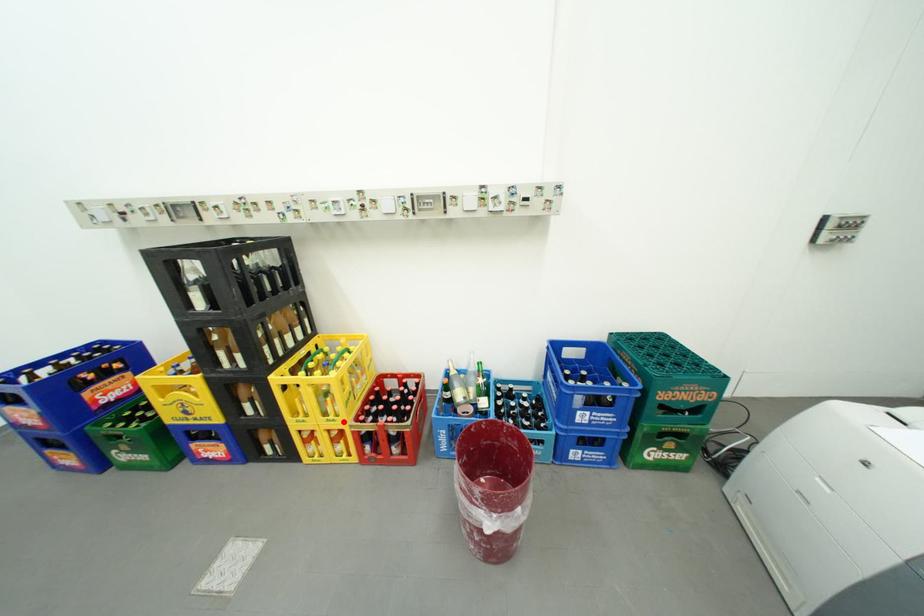
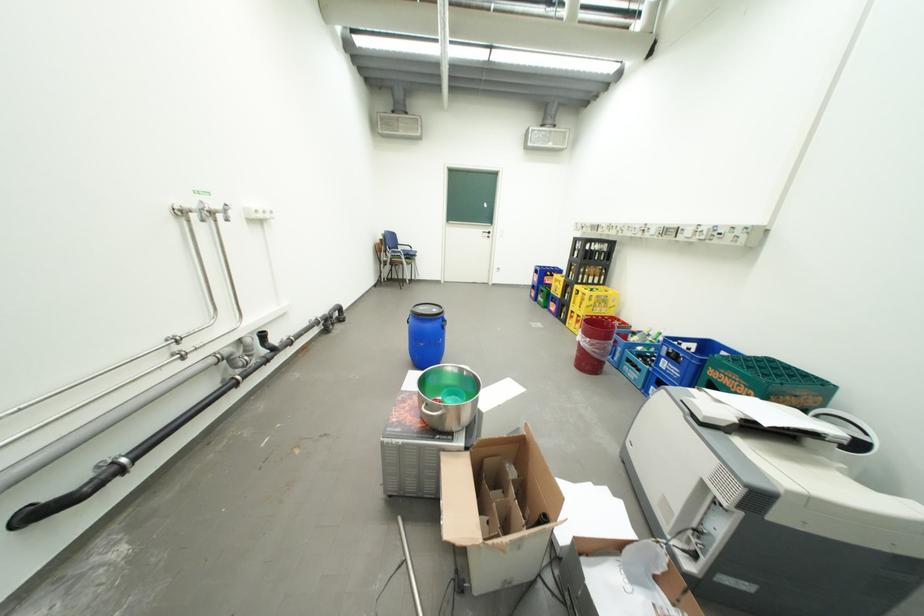
Question: I am providing you with two images of the same scene from different viewpoints. In image1, a red point is highlighted. Considering the same 3D point in image2, which of the following is correct?

Choices:
 (A) It is closer
 (B) It is farther

Answer: (A)